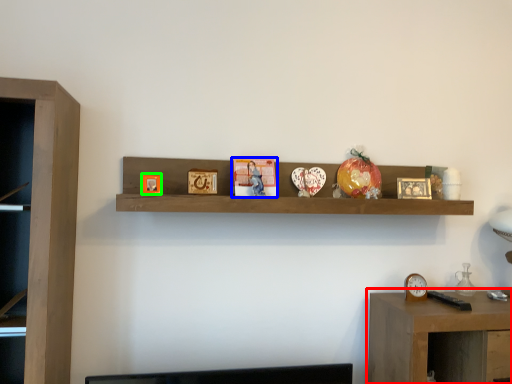
Question: Considering the real-world distances, which object is closest to table (highlighted by a red box)? book (highlighted by a blue box) or picture frame (highlighted by a green box).

Choices:
 (A) book
 (B) picture frame

Answer: (A)